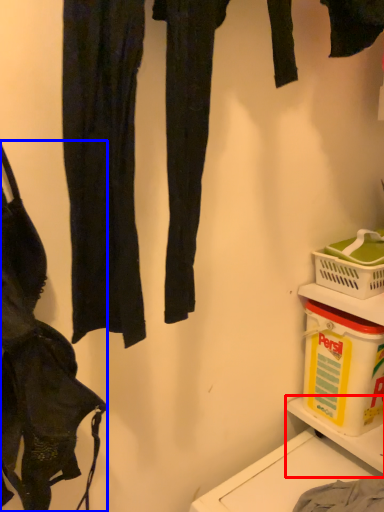
Question: Among these objects, which one is nearest to the camera, shelf (highlighted by a red box) or handbag (highlighted by a blue box)?

Choices:
 (A) shelf
 (B) handbag

Answer: (B)